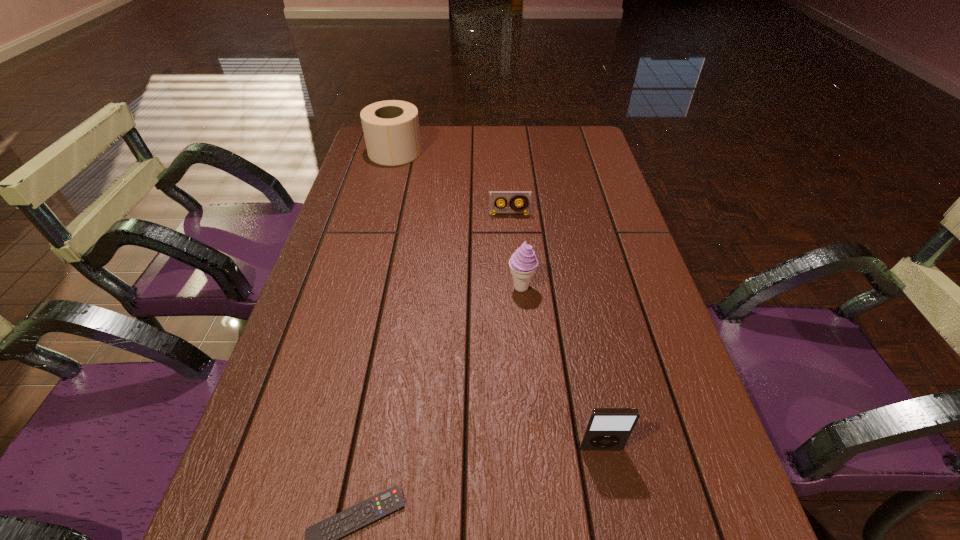
Identify the location of object present at the far edge. The image size is (960, 540). (391, 130).

Identify the location of object that is at the left edge. This screenshot has height=540, width=960. (391, 130).

Locate an element on the screen. object present at the right edge is located at coordinates (606, 428).

Find the location of `object at the far left corner`. object at the far left corner is located at coordinates (391, 130).

In the image, there is a desktop. Where is `vacant space at the left edge`? The image size is (960, 540). vacant space at the left edge is located at coordinates (356, 183).

Find the location of a particular element. free region at the right edge of the desktop is located at coordinates (661, 462).

Find the location of `vacant space at the far right corner of the desktop`. vacant space at the far right corner of the desktop is located at coordinates (548, 137).

Where is `vacant space in between the rightmost object and the toilet tissue`? The width and height of the screenshot is (960, 540). vacant space in between the rightmost object and the toilet tissue is located at coordinates (497, 300).

Identify the location of free space that is in between the fourth farthest object and the videotape. The image size is (960, 540). (555, 331).

The image size is (960, 540). I want to click on vacant area that lies between the icecream and the toilet tissue, so click(458, 220).